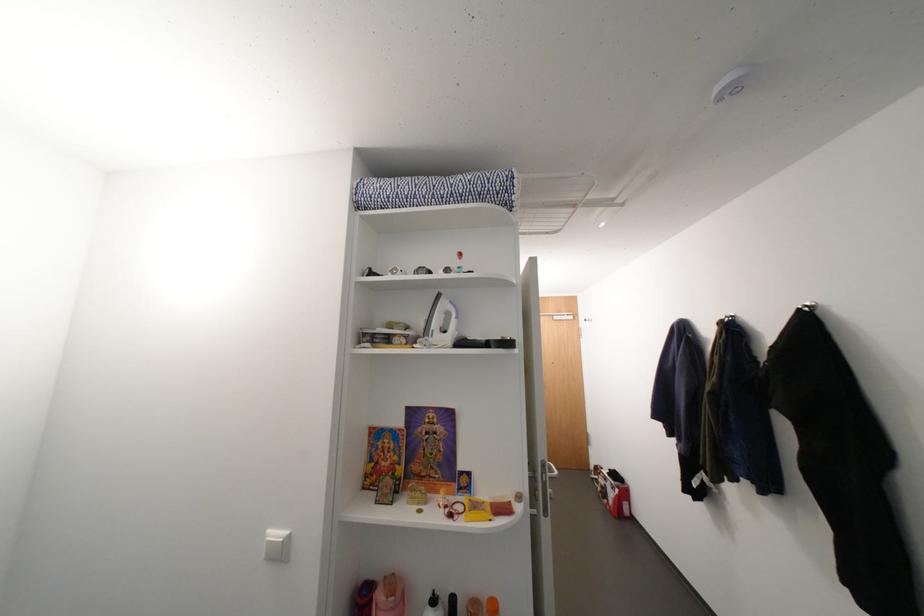
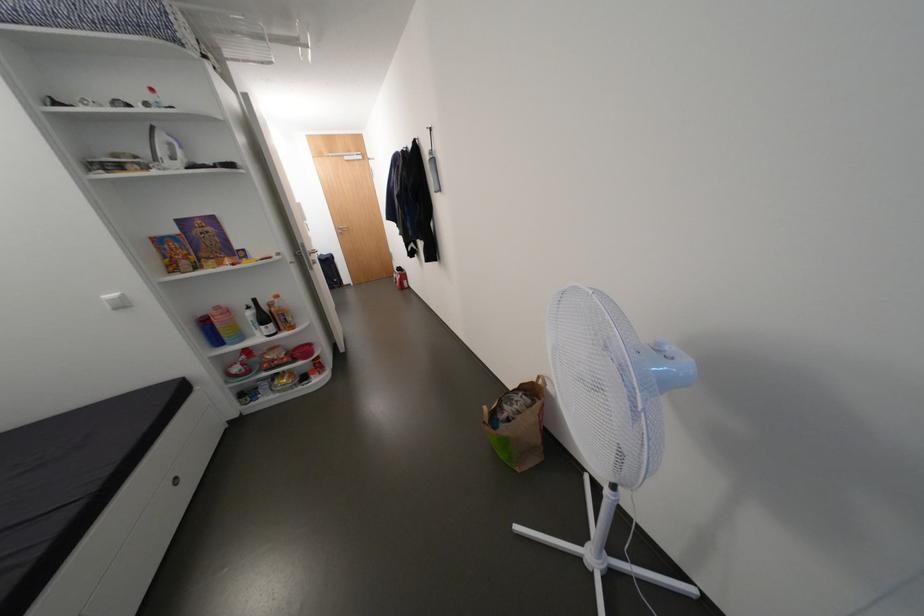
Question: I am providing you with two images of the same scene from different viewpoints. Which of the following objects are not visible in image2?

Choices:
 (A) fan control buttons
 (B) white water bottle
 (C) silver door handle
 (D) none of these

Answer: (D)